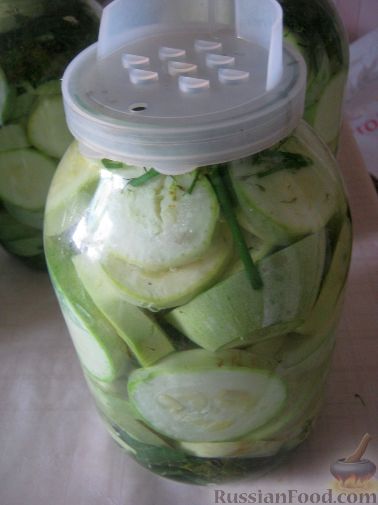
I want to click on jars, so click(x=120, y=374), click(x=46, y=128), click(x=336, y=34).